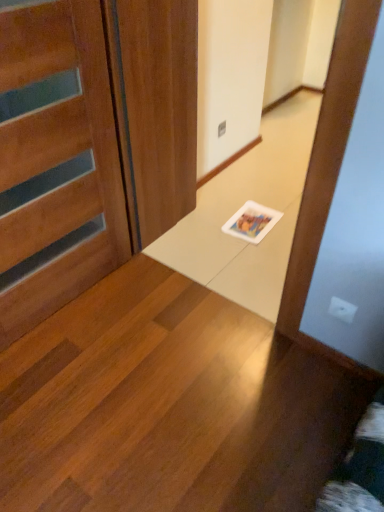
What do you see at coordinates (90, 143) in the screenshot? I see `wooden door at left` at bounding box center [90, 143].

Locate an element on the screen. Image resolution: width=384 pixels, height=512 pixels. wooden door at left is located at coordinates (90, 143).

Find the location of `wooden door at left`. wooden door at left is located at coordinates (90, 143).